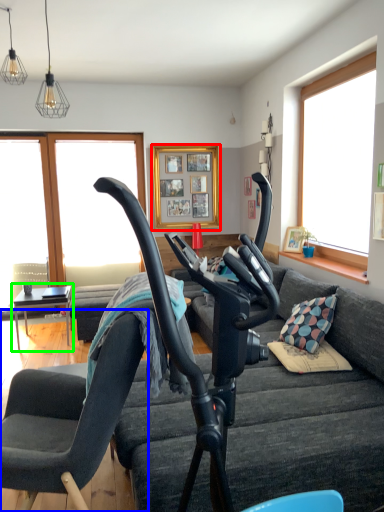
Question: Based on their relative distances, which object is farther from picture frame (highlighted by a red box)? Choose from chair (highlighted by a blue box) and table (highlighted by a green box).

Choices:
 (A) chair
 (B) table

Answer: (A)